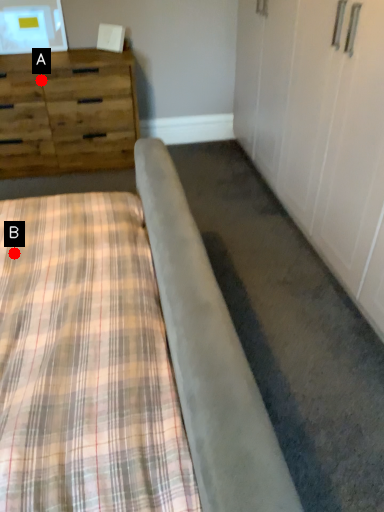
Question: Two points are circled on the image, labeled by A and B beside each circle. Among these points, which one is farthest from the camera?

Choices:
 (A) A is further
 (B) B is further

Answer: (A)